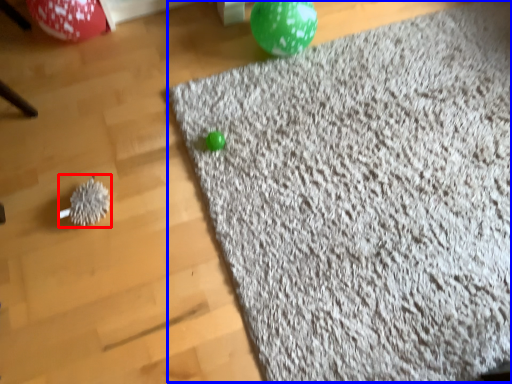
Question: Which object appears closest to the camera in this image, toy (highlighted by a red box) or mat (highlighted by a blue box)?

Choices:
 (A) toy
 (B) mat

Answer: (B)